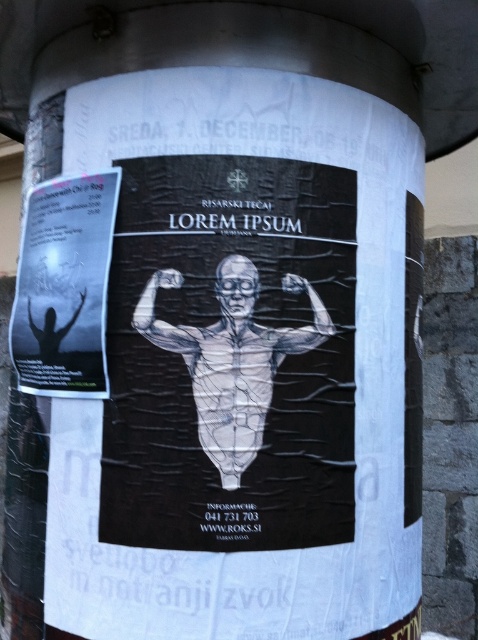
Is point (191, 352) more distant than point (86, 346)?

No, (191, 352) is in front of (86, 346).

The width and height of the screenshot is (478, 640). Find the location of `black paper poster at center`. black paper poster at center is located at coordinates (242, 365).

Measure the distance between point [127,168] and camera.

Point [127,168] is 2.09 meters away from camera.

The height and width of the screenshot is (640, 478). Identify the location of black paper poster at center. (242, 365).

Does point (66, 186) lie in front of point (257, 337)?

No, it is behind (257, 337).

Is black paper poster at left taller than translucent plastic figure at center?

Yes.

Does point (12, 323) lie in front of point (291, 333)?

No, (12, 323) is behind (291, 333).

This screenshot has width=478, height=640. Find the location of `black paper poster at left`. black paper poster at left is located at coordinates (65, 285).

Which is in front, point (145, 474) or point (316, 292)?

Point (145, 474) is in front.

Can you confirm if black paper poster at center is positioned above translucent plastic figure at center?

Yes.

Is point (297, 493) farther from camera compared to point (214, 342)?

That is True.

At what (x,y) coordinates should I click in order to perform the action: click on black paper poster at center. Please return your answer as a coordinate pair (x, y). Looking at the image, I should click on (242, 365).